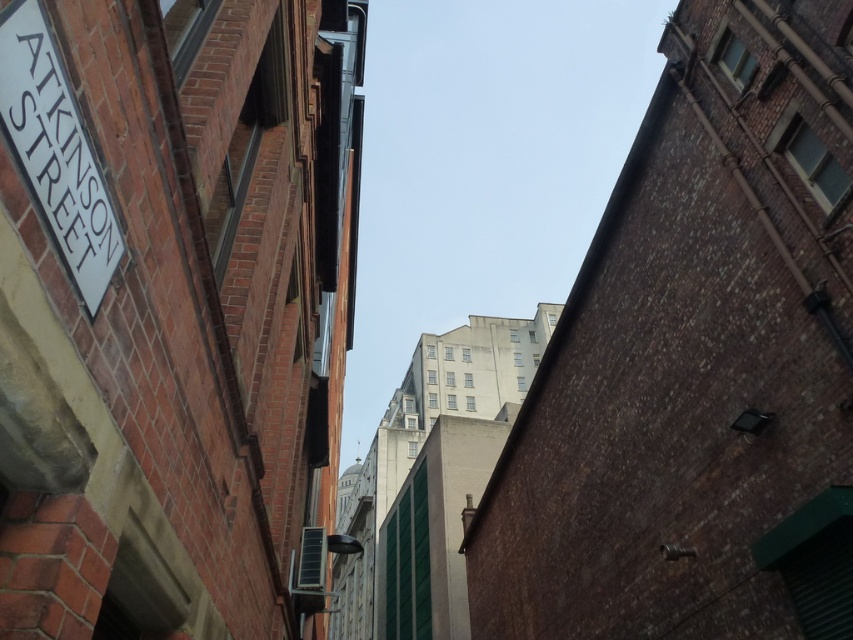
Question: Can you confirm if brown brick wall at upper center is bigger than white plastic street sign at upper left?

Choices:
 (A) no
 (B) yes

Answer: (B)

Question: Does brown brick wall at upper center appear under white plastic street sign at upper left?

Choices:
 (A) yes
 (B) no

Answer: (A)

Question: Which point is closer to the camera?

Choices:
 (A) white plastic street sign at upper left
 (B) brown brick wall at upper center

Answer: (A)

Question: Is brown brick wall at upper center closer to the viewer compared to white plastic street sign at upper left?

Choices:
 (A) no
 (B) yes

Answer: (A)

Question: Which point is farther to the camera?

Choices:
 (A) (585, 269)
 (B) (61, 154)

Answer: (A)

Question: Which point appears farthest from the camera in this image?

Choices:
 (A) [59, 58]
 (B) [671, 480]

Answer: (B)